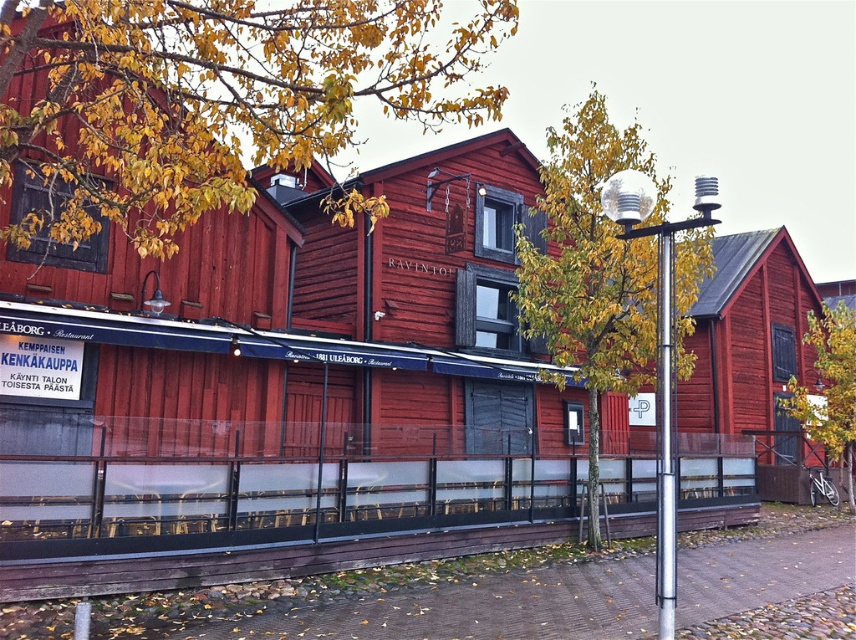
Question: From the image, what is the correct spatial relationship of yellow leaves at upper left in relation to yellow-green foliage at center?

Choices:
 (A) below
 (B) above

Answer: (B)

Question: Does silver metallic pole at center appear over green leafy tree at lower right?

Choices:
 (A) yes
 (B) no

Answer: (A)

Question: Based on their relative distances, which object is nearer to the yellow leaves at upper left?

Choices:
 (A) yellow-green foliage at center
 (B) silver metallic pole at center
 (C) green leafy tree at lower right
 (D) metallic pole at right

Answer: (A)

Question: Among these points, which one is nearest to the camera?

Choices:
 (A) (672, 531)
 (B) (596, 115)
 (C) (675, 486)
 (D) (825, 369)

Answer: (A)

Question: Which point is farther from the camera taking this photo?

Choices:
 (A) (31, 90)
 (B) (538, 337)
 (C) (658, 429)
 (D) (655, 588)

Answer: (B)

Question: Does yellow leaves at upper left have a greater width compared to metallic pole at right?

Choices:
 (A) no
 (B) yes

Answer: (B)